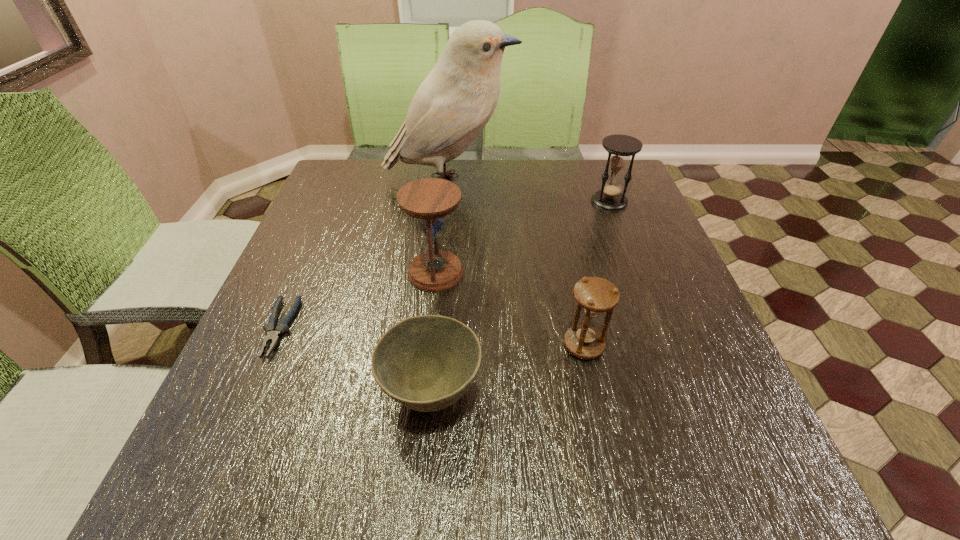
The image size is (960, 540). I want to click on the tallest object, so click(x=456, y=100).

Locate an element on the screen. This screenshot has width=960, height=540. the leftmost hourglass is located at coordinates (429, 200).

Image resolution: width=960 pixels, height=540 pixels. Identify the location of the fourth nearest object. (429, 200).

The image size is (960, 540). What are the coordinates of `the farthest hourglass` in the screenshot? It's located at (620, 147).

At what (x,y) coordinates should I click in order to perform the action: click on the rightmost hourglass. Please return your answer as a coordinate pair (x, y). Image resolution: width=960 pixels, height=540 pixels. Looking at the image, I should click on (620, 147).

This screenshot has height=540, width=960. Find the location of `the nearest hourglass`. the nearest hourglass is located at coordinates 594,295.

At what (x,y) coordinates should I click in order to perform the action: click on the fifth object from left to right. Please return your answer as a coordinate pair (x, y). The height and width of the screenshot is (540, 960). Looking at the image, I should click on (594, 295).

This screenshot has height=540, width=960. I want to click on the second shortest object, so click(x=426, y=363).

Identify the location of the leftmost object. The height and width of the screenshot is (540, 960). (273, 332).

At what (x,y) coordinates should I click in order to perform the action: click on pliers. Please return your answer as a coordinate pair (x, y). Image resolution: width=960 pixels, height=540 pixels. Looking at the image, I should click on (273, 332).